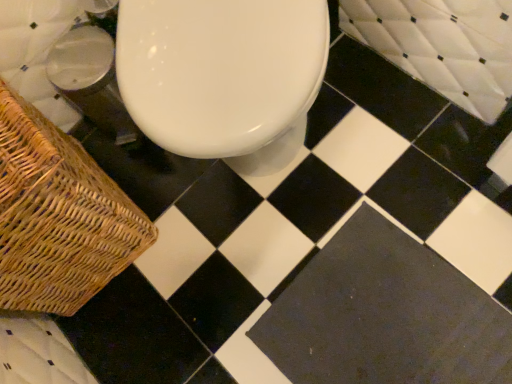
In order to face woven brown picnic basket at lower left, should I rotate leftwards or rightwards?

It's best to rotate left around 29.686 degrees.

Measure the distance between point [448,73] and camera.

They are 37.28 inches apart.

In order to face black matte tile at center, should I rotate leftwards or rightwards?

Turn right approximately 16.945 degrees to face it.

Where is `woven brown picnic basket at lower left`? Image resolution: width=512 pixels, height=384 pixels. woven brown picnic basket at lower left is located at coordinates (58, 216).

What's the angular difference between white quilted bath at upper right and woven brown picnic basket at lower left's facing directions?

88.5 degrees separate the facing orientations of white quilted bath at upper right and woven brown picnic basket at lower left.

Considering the relative sizes of white quilted bath at upper right and woven brown picnic basket at lower left in the image provided, is white quilted bath at upper right smaller than woven brown picnic basket at lower left?

Yes.

At what (x,y) coordinates should I click in order to perform the action: click on picnic basket on the left of white quilted bath at upper right. Please return your answer as a coordinate pair (x, y). Looking at the image, I should click on pyautogui.click(x=58, y=216).

From a real-world perspective, who is located lower, white quilted bath at upper right or woven brown picnic basket at lower left?

white quilted bath at upper right is physically lower.

Does white quilted bath at upper right turn towards black matte tile at center?

Yes, white quilted bath at upper right faces towards black matte tile at center.

From the image's perspective, which one is positioned higher, white quilted bath at upper right or black matte tile at center?

white quilted bath at upper right is shown above in the image.

Consider the image. Is white quilted bath at upper right closer to the viewer compared to black matte tile at center?

Yes, the depth of white quilted bath at upper right is less than that of black matte tile at center.

From a real-world perspective, is white quilted bath at upper right positioned under black matte tile at center based on gravity?

No.

Is point (362, 242) less distant than point (502, 103)?

No, it is behind (502, 103).

Is black matte tile at center not near white quilted bath at upper right?

No, black matte tile at center is in close proximity to white quilted bath at upper right.

Does black matte tile at center have a smaller size compared to white quilted bath at upper right?

Yes.

Considering the relative sizes of woven brown picnic basket at lower left and black matte tile at center in the image provided, is woven brown picnic basket at lower left wider than black matte tile at center?

Correct, the width of woven brown picnic basket at lower left exceeds that of black matte tile at center.

Is there a large distance between woven brown picnic basket at lower left and black matte tile at center?

No, woven brown picnic basket at lower left is not far away from black matte tile at center.

Looking at this image, which of these two, woven brown picnic basket at lower left or black matte tile at center, is smaller?

Smaller between the two is black matte tile at center.

Can you tell me how much woven brown picnic basket at lower left and black matte tile at center differ in facing direction?

They differ by 86.7 degrees in their facing directions.

Considering the sizes of woven brown picnic basket at lower left and white quilted bath at upper right in the image, is woven brown picnic basket at lower left taller or shorter than white quilted bath at upper right?

In the image, woven brown picnic basket at lower left appears to be taller than white quilted bath at upper right.

From the image's perspective, is woven brown picnic basket at lower left located above or below white quilted bath at upper right?

woven brown picnic basket at lower left is situated lower than white quilted bath at upper right in the image.

Which of these two, woven brown picnic basket at lower left or white quilted bath at upper right, is thinner?

With smaller width is white quilted bath at upper right.

From a real-world perspective, is black matte tile at center under woven brown picnic basket at lower left?

Yes, from a real-world perspective, black matte tile at center is beneath woven brown picnic basket at lower left.

Considering the relative sizes of black matte tile at center and woven brown picnic basket at lower left in the image provided, is black matte tile at center shorter than woven brown picnic basket at lower left?

Correct, black matte tile at center is not as tall as woven brown picnic basket at lower left.

Locate an element on the screen. picnic basket in front of the black matte tile at center is located at coordinates (58, 216).

In terms of size, does black matte tile at center appear bigger or smaller than woven brown picnic basket at lower left?

black matte tile at center is smaller than woven brown picnic basket at lower left.

This screenshot has height=384, width=512. Identify the location of bath that appears below the woven brown picnic basket at lower left (from a real-world perspective). (443, 45).

The width and height of the screenshot is (512, 384). Identify the location of bath above the black matte tile at center (from a real-world perspective). (443, 45).

Looking at the image, which one is located closer to white quilted bath at upper right, woven brown picnic basket at lower left or black matte tile at center?

The object closer to white quilted bath at upper right is black matte tile at center.

Looking at the image, which one is located further to woven brown picnic basket at lower left, white quilted bath at upper right or black matte tile at center?

The object further to woven brown picnic basket at lower left is white quilted bath at upper right.

Estimate the real-world distances between objects in this image. Which object is further from black matte tile at center, woven brown picnic basket at lower left or white quilted bath at upper right?

woven brown picnic basket at lower left is further to black matte tile at center.

Estimate the real-world distances between objects in this image. Which object is further from woven brown picnic basket at lower left, black matte tile at center or white quilted bath at upper right?

Among the two, white quilted bath at upper right is located further to woven brown picnic basket at lower left.

When comparing their distances from black matte tile at center, does white quilted bath at upper right or woven brown picnic basket at lower left seem closer?

white quilted bath at upper right is closer to black matte tile at center.

Which object lies further to the anchor point white quilted bath at upper right, black matte tile at center or woven brown picnic basket at lower left?

woven brown picnic basket at lower left lies further to white quilted bath at upper right than the other object.

The width and height of the screenshot is (512, 384). What are the coordinates of `square situated between woven brown picnic basket at lower left and white quilted bath at upper right from left to right` in the screenshot? It's located at (384, 315).